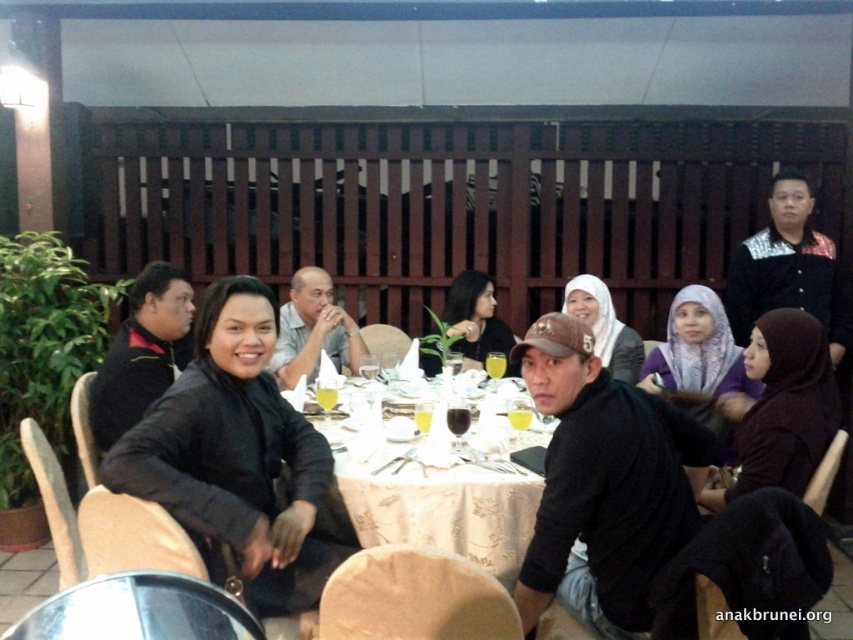
Question: Based on their relative distances, which object is nearer to the white fabric table at center?

Choices:
 (A) black matte jacket at center
 (B) matte black dress at center

Answer: (A)

Question: Is black matte jacket at center closer to camera compared to matte black hijab at center?

Choices:
 (A) no
 (B) yes

Answer: (B)

Question: Is white fabric table at center thinner than matte black dress at center?

Choices:
 (A) yes
 (B) no

Answer: (B)

Question: Which object appears farthest from the camera in this image?

Choices:
 (A) white fabric table at center
 (B) matte black hijab at center
 (C) black matte hijab at center

Answer: (B)

Question: Which object appears closest to the camera in this image?

Choices:
 (A) matte black hijab at center
 (B) white fabric table at center
 (C) black matte hijab at center

Answer: (B)

Question: Can you confirm if black matte jacket at center is positioned to the right of matte black dress at center?

Choices:
 (A) yes
 (B) no

Answer: (B)